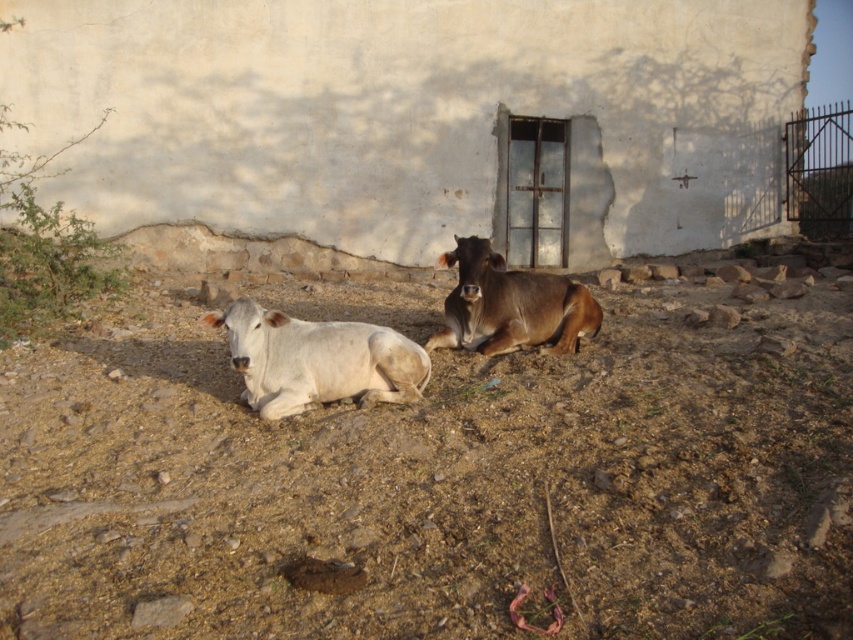
Question: Is white smooth cow at center thinner than brown glossy bull at center?

Choices:
 (A) yes
 (B) no

Answer: (A)

Question: Can you confirm if brown soil at center is positioned to the left of white smooth cow at center?

Choices:
 (A) yes
 (B) no

Answer: (A)

Question: Among these objects, which one is farthest from the camera?

Choices:
 (A) white smooth cow at center
 (B) brown soil at center

Answer: (A)

Question: Observing the image, what is the correct spatial positioning of brown soil at center in reference to brown glossy bull at center?

Choices:
 (A) right
 (B) left

Answer: (B)

Question: Among these objects, which one is nearest to the camera?

Choices:
 (A) brown soil at center
 (B) white smooth cow at center
 (C) brown glossy bull at center

Answer: (A)

Question: Which point appears closest to the camera in this image?

Choices:
 (A) (395, 385)
 (B) (515, 292)
 (C) (666, 493)

Answer: (C)